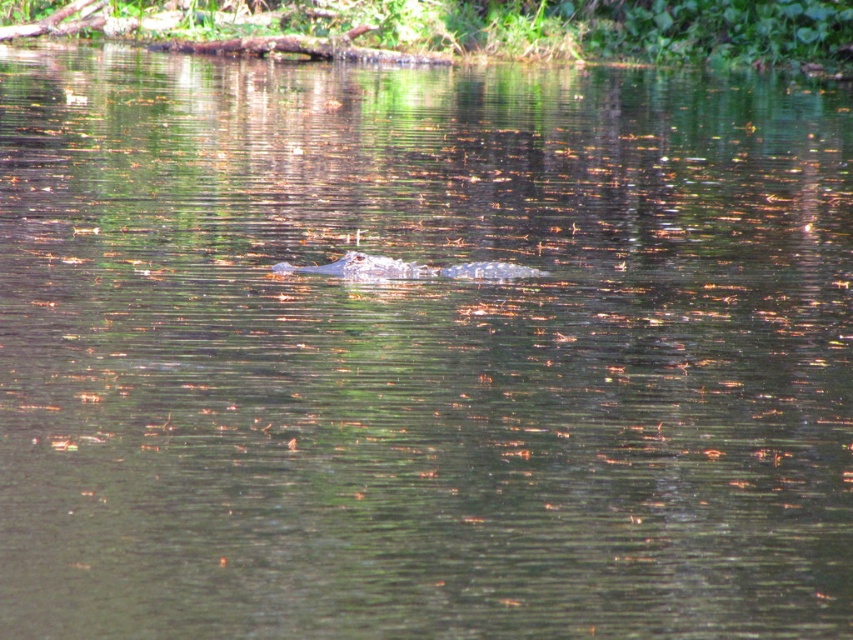
Question: Among these points, which one is nearest to the camera?

Choices:
 (A) (178, 28)
 (B) (531, 268)

Answer: (B)

Question: Can you confirm if green leafy vegetation at upper center is positioned above grayish-green scaly crocodile at center?

Choices:
 (A) no
 (B) yes

Answer: (B)

Question: Which point is closer to the camera?

Choices:
 (A) (775, 6)
 (B) (422, 266)

Answer: (B)

Question: Which object appears farthest from the camera in this image?

Choices:
 (A) green leafy vegetation at upper center
 (B) grayish-green scaly crocodile at center

Answer: (A)

Question: Can you confirm if green leafy vegetation at upper center is bigger than grayish-green scaly crocodile at center?

Choices:
 (A) no
 (B) yes

Answer: (B)

Question: Is green leafy vegetation at upper center behind grayish-green scaly crocodile at center?

Choices:
 (A) yes
 (B) no

Answer: (A)